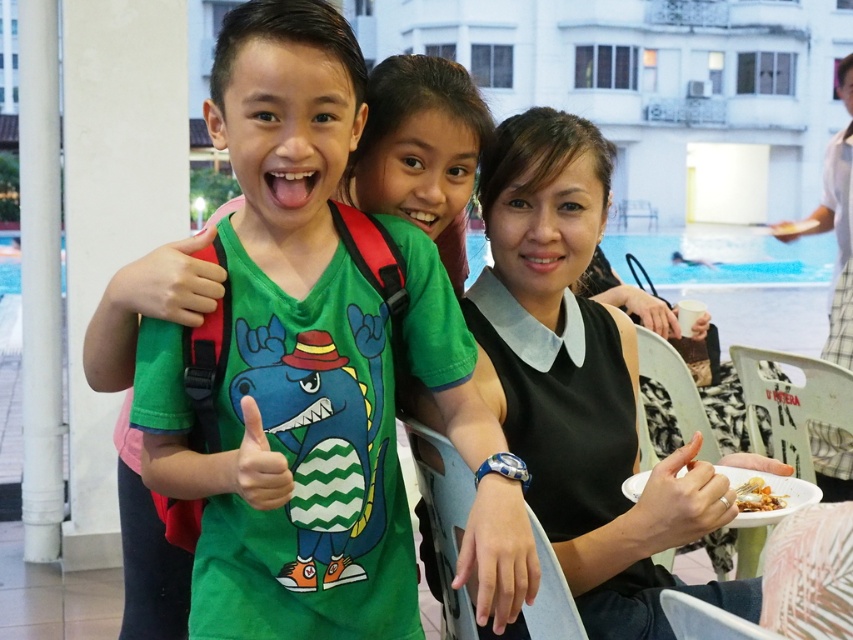
Can you confirm if green matte t-shirt at center is taller than matte green t-shirt at center?

Yes.

Which is more to the right, green matte t-shirt at center or matte green t-shirt at center?

Positioned to the right is matte green t-shirt at center.

Find the location of `green matte t-shirt at center`. green matte t-shirt at center is located at coordinates (287, 362).

Locate an element on the screen. This screenshot has width=853, height=640. green matte t-shirt at center is located at coordinates (287, 362).

Measure the distance from green matte t-shirt at center to golden crispy fried chicken at lower right.

green matte t-shirt at center is 36.04 inches from golden crispy fried chicken at lower right.

Is green matte t-shirt at center closer to the viewer compared to golden crispy fried chicken at lower right?

Yes, green matte t-shirt at center is in front of golden crispy fried chicken at lower right.

Locate an element on the screen. The image size is (853, 640). green matte t-shirt at center is located at coordinates (287, 362).

Is matte green t-shirt at center thinner than golden crispy fried chicken at lower right?

Incorrect, matte green t-shirt at center's width is not less than golden crispy fried chicken at lower right's.

Between point (711, 528) and point (772, 509), which one is positioned in front?

Point (711, 528) is in front.

Where is `matte green t-shirt at center`? The image size is (853, 640). matte green t-shirt at center is located at coordinates (579, 384).